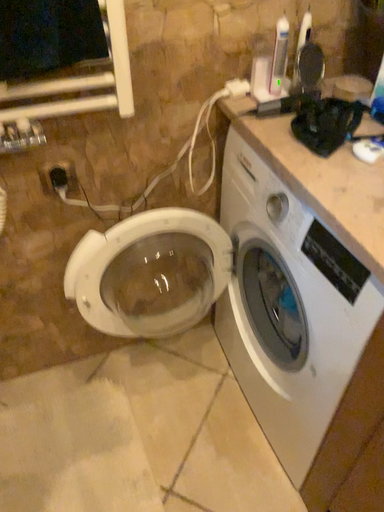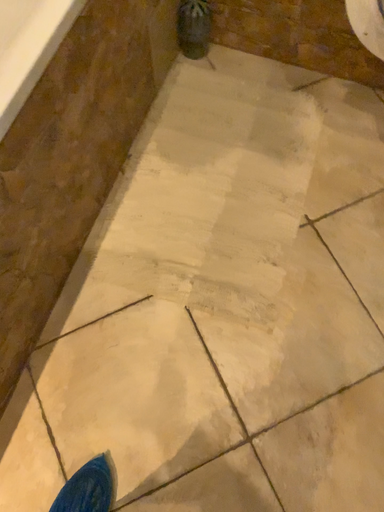
Question: How did the camera likely rotate when shooting the video?

Choices:
 (A) rotated downward
 (B) rotated upward

Answer: (A)